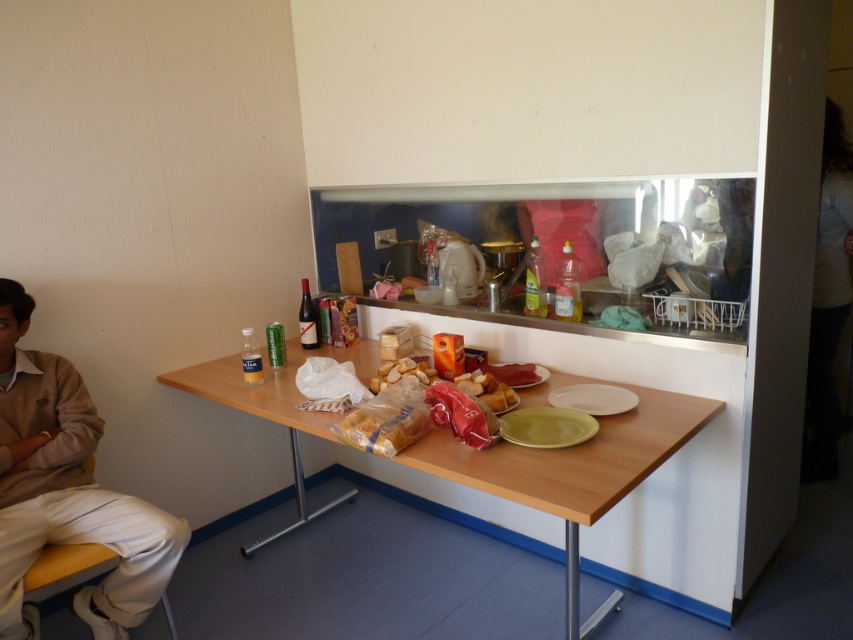
You are a guest in this communal dining area and want to place a small plate on the wooden table at center. Considering the height of the golden brown bread at center, will the plate be visible from above the bread?

The wooden table at center is taller than the golden brown bread at center, so placing the plate on the table will make it visible from above the bread.